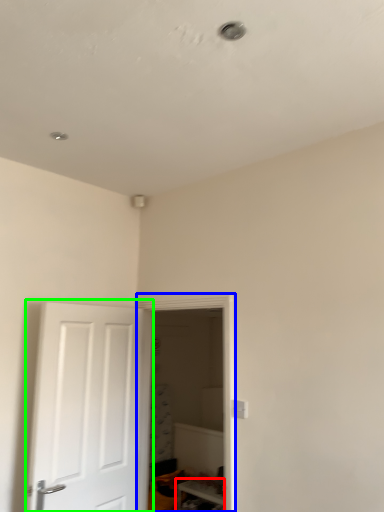
Question: Considering the real-world distances, which object is farthest from furniture (highlighted by a red box)? glass door (highlighted by a blue box) or door (highlighted by a green box)?

Choices:
 (A) glass door
 (B) door

Answer: (A)